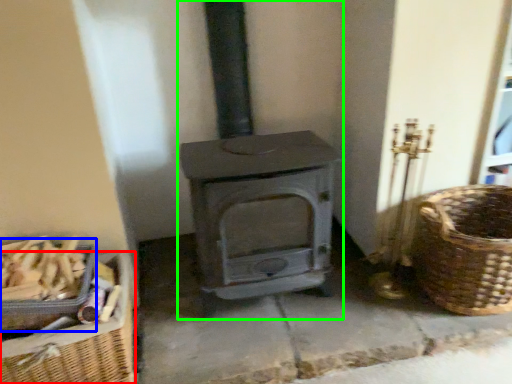
Question: Considering the real-world distances, which object is farthest from basket (highlighted by a red box)? basket (highlighted by a blue box) or wood burning stove (highlighted by a green box)?

Choices:
 (A) basket
 (B) wood burning stove

Answer: (B)